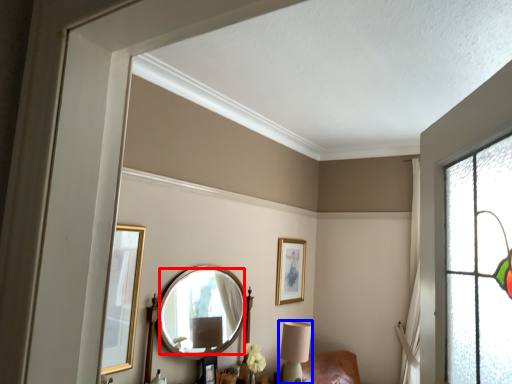
Question: Which object appears farthest to the camera in this image, mirror (highlighted by a red box) or table lamp (highlighted by a blue box)?

Choices:
 (A) mirror
 (B) table lamp

Answer: (B)